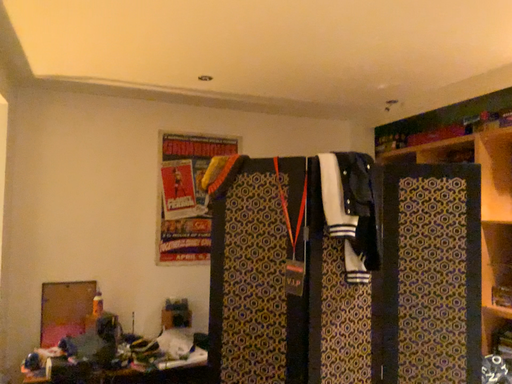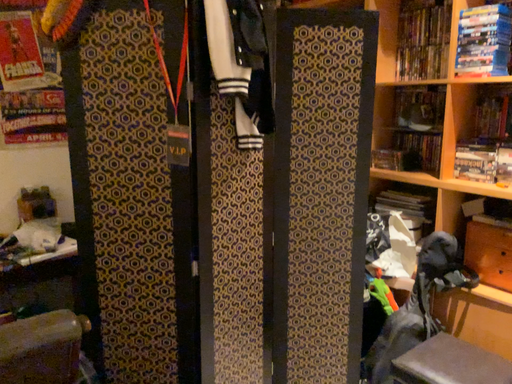
Question: How did the camera likely rotate when shooting the video?

Choices:
 (A) rotated downward
 (B) rotated upward

Answer: (A)